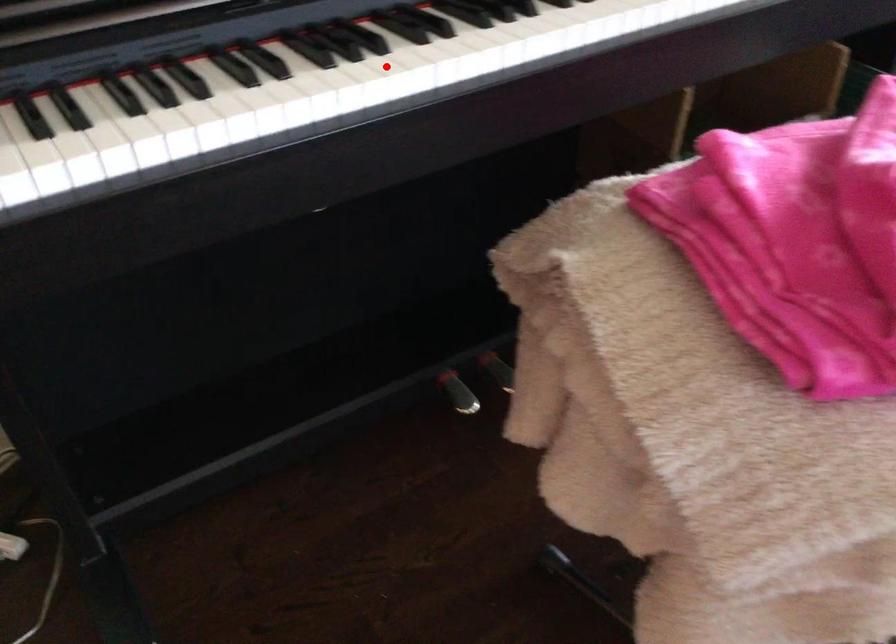
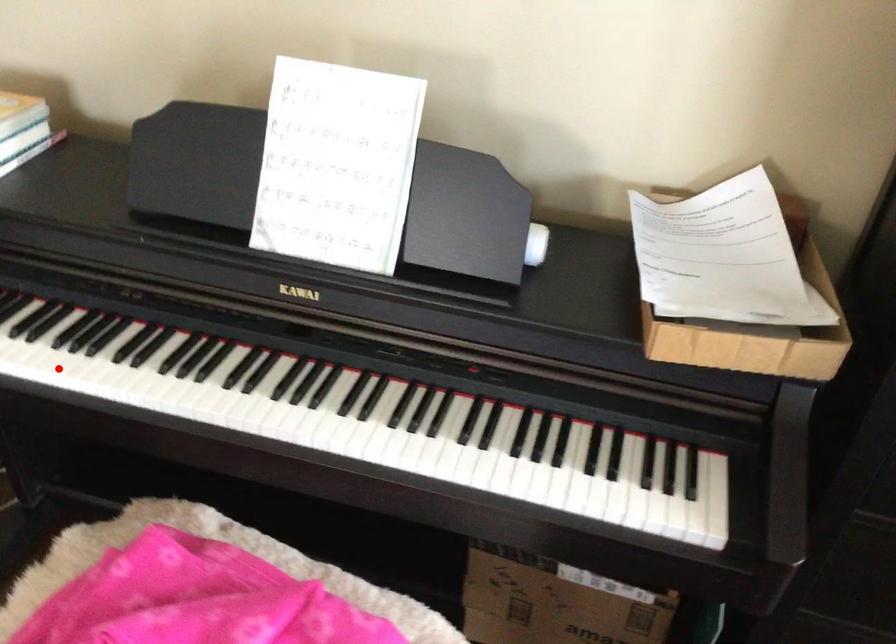
I am providing you with two images of the same scene from different viewpoints. A red point is marked on the first image and another point is marked on the second image. Is the red point in image1 aligned with the point shown in image2?

Yes